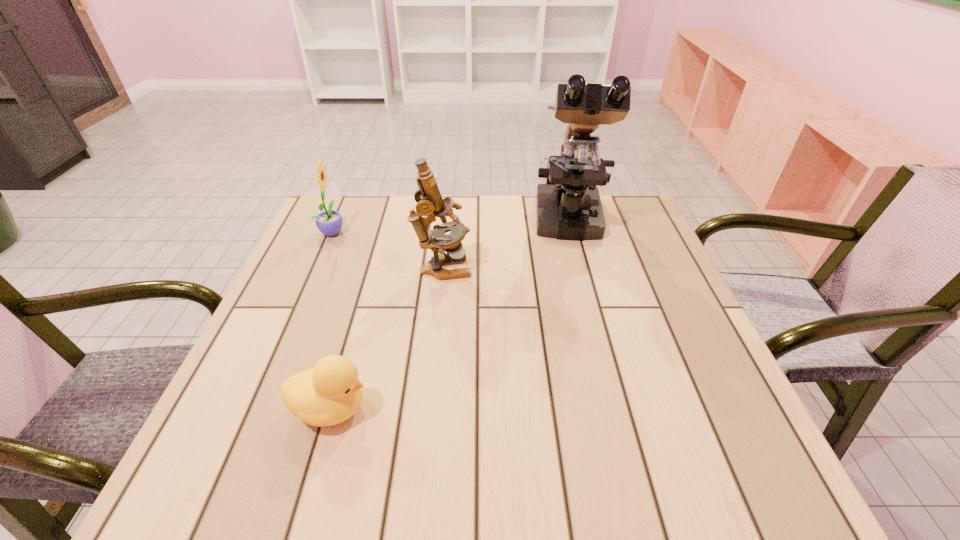
At what (x,y) coordinates should I click in order to perform the action: click on vacant space situated 0.100m on the front-facing side of the leftmost object. Please return your answer as a coordinate pair (x, y). Looking at the image, I should click on (384, 231).

I want to click on vacant position located on the front-facing side of the duck, so click(x=504, y=408).

Locate an element on the screen. microscope at the far edge is located at coordinates (568, 207).

You are a GUI agent. You are given a task and a screenshot of the screen. Output one action in this format:
    pyautogui.click(x=<x>, y=<y>)
    Task: Click on the sunflower present at the far edge
    
    Given the screenshot: What is the action you would take?
    pyautogui.click(x=329, y=222)

In order to click on object at the near edge in this screenshot , I will do `click(330, 393)`.

Where is `sunflower present at the left edge`? This screenshot has width=960, height=540. sunflower present at the left edge is located at coordinates (329, 222).

The width and height of the screenshot is (960, 540). What are the coordinates of `duck that is at the left edge` in the screenshot? It's located at (330, 393).

Where is `object that is at the right edge`? This screenshot has width=960, height=540. object that is at the right edge is located at coordinates (568, 207).

You are a GUI agent. You are given a task and a screenshot of the screen. Output one action in this format:
    pyautogui.click(x=<x>, y=<y>)
    Task: Click on the object that is at the far left corner
    
    Given the screenshot: What is the action you would take?
    pyautogui.click(x=329, y=222)

Where is `object located at the near left corner`? This screenshot has height=540, width=960. object located at the near left corner is located at coordinates (330, 393).